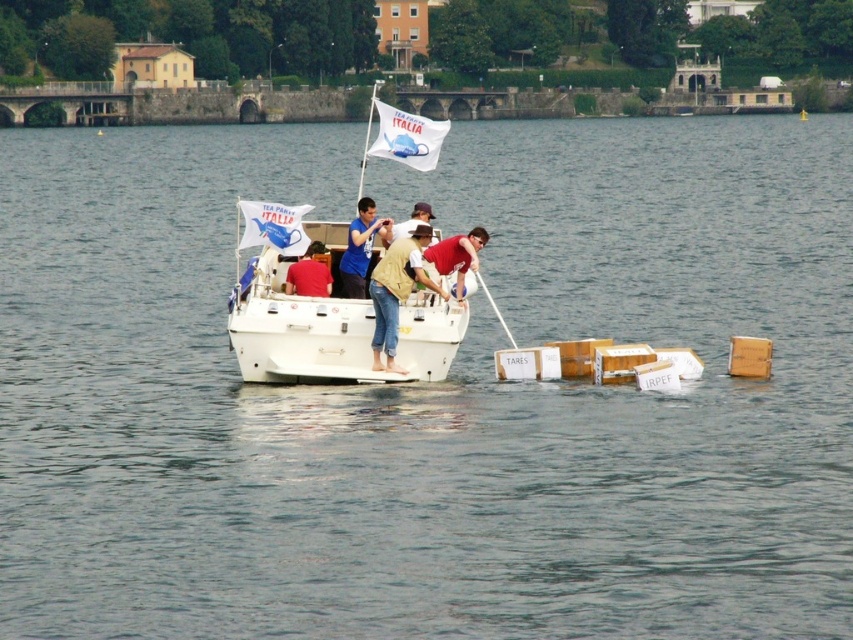
Does blue fabric flag at center appear over brown leather hat at center?

No.

This screenshot has width=853, height=640. Identify the location of blue fabric flag at center. tap(273, 227).

Locate an element on the screen. The height and width of the screenshot is (640, 853). blue fabric flag at center is located at coordinates (273, 227).

Is matte red shirt at center below brown leather hat at center?

Yes, matte red shirt at center is below brown leather hat at center.

Where is `matte red shirt at center`? Image resolution: width=853 pixels, height=640 pixels. matte red shirt at center is located at coordinates (456, 257).

Is point (474, 252) more distant than point (393, 237)?

No, (474, 252) is closer to viewer.

At what (x,y) coordinates should I click in order to perform the action: click on matte red shirt at center. Please return your answer as a coordinate pair (x, y). The image size is (853, 640). Looking at the image, I should click on (456, 257).

Is blue fabric shirt at center to the right of matte red shirt at center from the viewer's perspective?

Incorrect, blue fabric shirt at center is not on the right side of matte red shirt at center.

Does point (351, 253) come closer to viewer compared to point (477, 259)?

No.

Describe the element at coordinates (360, 248) in the screenshot. I see `blue fabric shirt at center` at that location.

I want to click on blue fabric shirt at center, so click(360, 248).